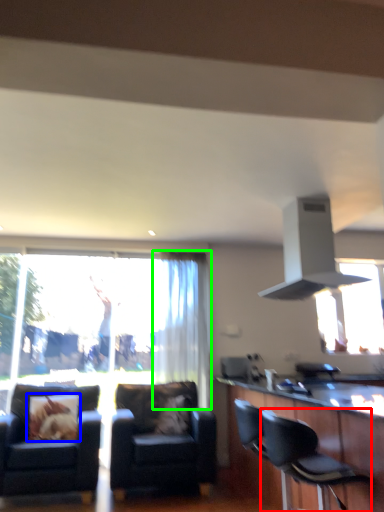
Question: Based on their relative distances, which object is farther from chair (highlighted by a red box)? Choose from pillow (highlighted by a blue box) and curtain (highlighted by a green box).

Choices:
 (A) pillow
 (B) curtain

Answer: (B)